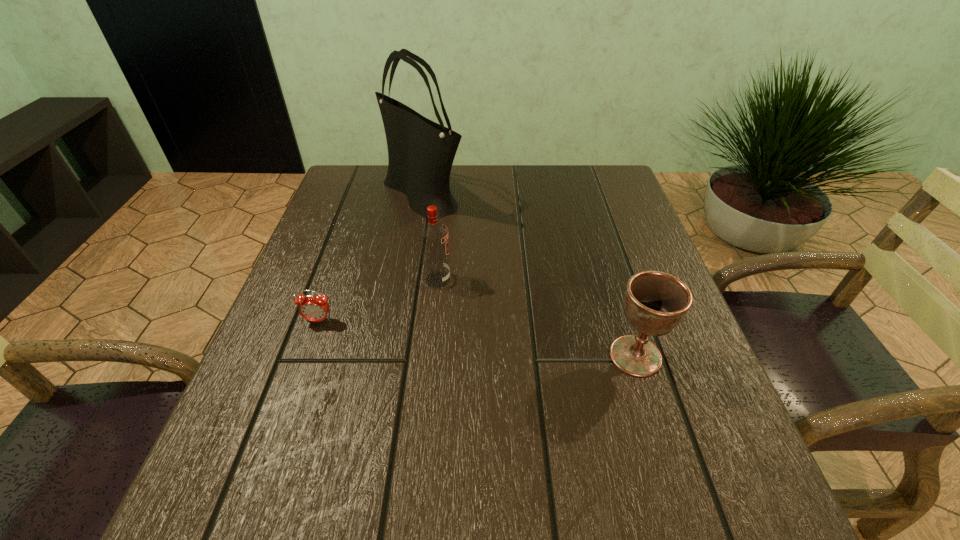
Locate which object is the second closest to the farthest object. Please provide its 2D coordinates. Your answer should be formatted as a tuple, i.e. [(x, y)], where the tuple contains the x and y coordinates of a point satisfying the conditions above.

[(313, 308)]

The image size is (960, 540). I want to click on blank space that satisfies the following two spatial constraints: 1. on the face of the nearest object; 2. on the right side of the shortest object, so click(x=306, y=356).

In order to click on free spot that satisfies the following two spatial constraints: 1. on the front side of the nearest object; 2. on the left side of the farthest object in this screenshot , I will do point(395,356).

This screenshot has height=540, width=960. In order to click on free location that satisfies the following two spatial constraints: 1. on the face of the alarm clock; 2. on the left side of the nearest object in this screenshot , I will do [x=306, y=356].

Where is `free space in the image that satisfies the following two spatial constraints: 1. on the front label of the chalice; 2. on the left side of the vodka`? free space in the image that satisfies the following two spatial constraints: 1. on the front label of the chalice; 2. on the left side of the vodka is located at coordinates (430, 356).

This screenshot has height=540, width=960. In order to click on free space that satisfies the following two spatial constraints: 1. on the front label of the nearest object; 2. on the right side of the third nearest object in this screenshot , I will do `click(430, 356)`.

You are a GUI agent. You are given a task and a screenshot of the screen. Output one action in this format:
    pyautogui.click(x=<x>, y=<y>)
    Task: Click on the vacant space that satisfies the following two spatial constraints: 1. on the front side of the chalice; 2. on the right side of the farthest object
    
    Given the screenshot: What is the action you would take?
    pyautogui.click(x=395, y=356)

Where is `free point that satisfies the following two spatial constraints: 1. on the front label of the second farthest object; 2. on the face of the shortest object`? The width and height of the screenshot is (960, 540). free point that satisfies the following two spatial constraints: 1. on the front label of the second farthest object; 2. on the face of the shortest object is located at coordinates (434, 321).

The width and height of the screenshot is (960, 540). What are the coordinates of `free space that satisfies the following two spatial constraints: 1. on the front label of the vodka; 2. on the left side of the rightmost object` in the screenshot? It's located at (430, 356).

Locate an element on the screen. This screenshot has width=960, height=540. vacant point that satisfies the following two spatial constraints: 1. on the front label of the vodka; 2. on the face of the shortest object is located at coordinates (434, 321).